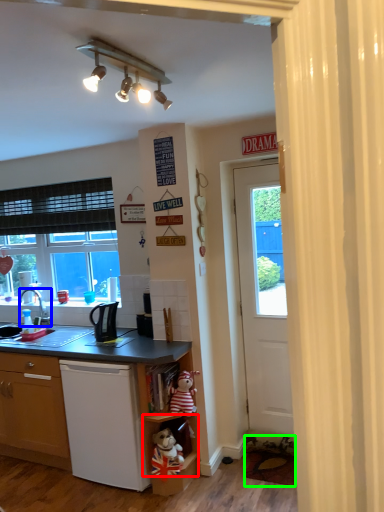
Question: Based on their relative distances, which object is nearer to shelf (highlighted by a red box)? Choose from faucet (highlighted by a blue box) and carpets (highlighted by a green box).

Choices:
 (A) faucet
 (B) carpets

Answer: (B)